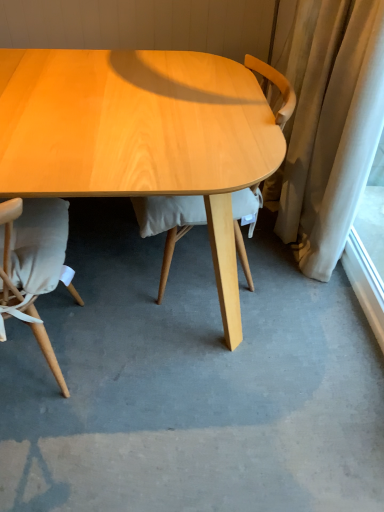
I want to click on free space in front of light wood chair at center, which is counted as the second chair, starting from the left, so click(x=198, y=370).